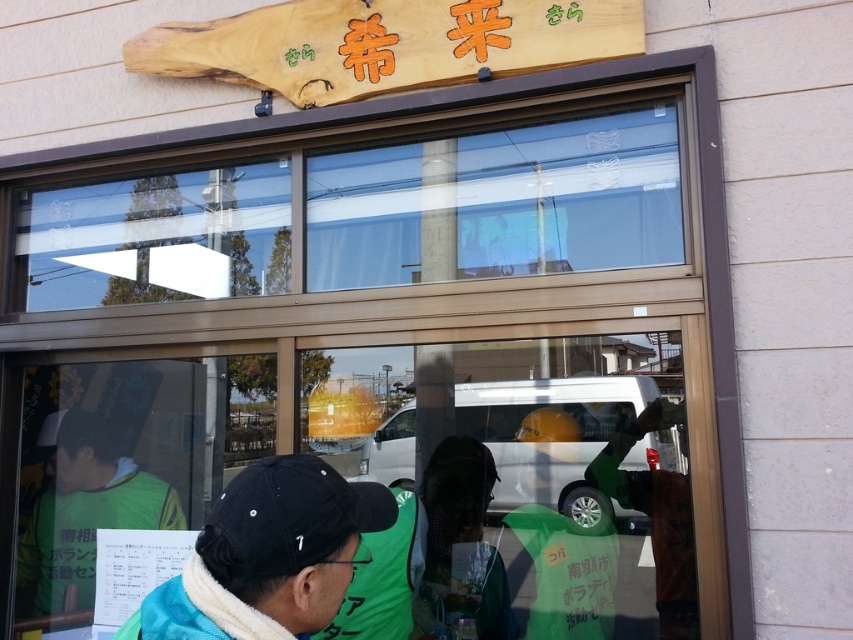
Question: Considering the relative positions of black fabric cap at center and black matte baseball cap at center in the image provided, where is black fabric cap at center located with respect to black matte baseball cap at center?

Choices:
 (A) left
 (B) right

Answer: (A)

Question: Which is farther from the black fabric cap at center?

Choices:
 (A) green fabric vest at lower left
 (B) black matte baseball cap at center
 (C) transparent glass window at center

Answer: (A)

Question: Does transparent glass window at center have a greater width compared to black fabric cap at center?

Choices:
 (A) no
 (B) yes

Answer: (B)

Question: Which object is farther from the camera taking this photo?

Choices:
 (A) black fabric cap at center
 (B) green fabric vest at lower left
 (C) black matte baseball cap at center
 (D) transparent glass window at center

Answer: (B)

Question: Which of the following is the closest to the observer?

Choices:
 (A) transparent glass window at center
 (B) green fabric vest at lower left

Answer: (A)

Question: Is transparent glass window at center positioned behind black matte baseball cap at center?

Choices:
 (A) yes
 (B) no

Answer: (A)